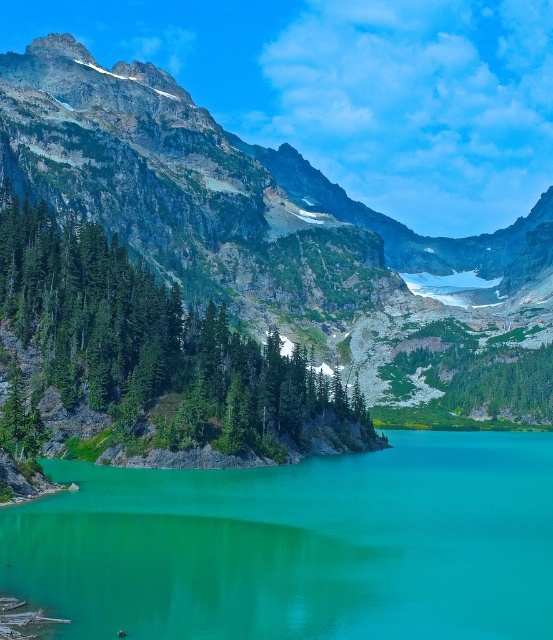
What do you see at coordinates (284, 240) in the screenshot? I see `rugged granite mountain at upper left` at bounding box center [284, 240].

Between rugged granite mountain at upper left and turquoise glossy water at center, which one is positioned lower?

turquoise glossy water at center

Between point (534, 340) and point (143, 544), which one is positioned behind?

Positioned behind is point (534, 340).

Find the location of a particular element. This screenshot has height=640, width=553. rugged granite mountain at upper left is located at coordinates (284, 240).